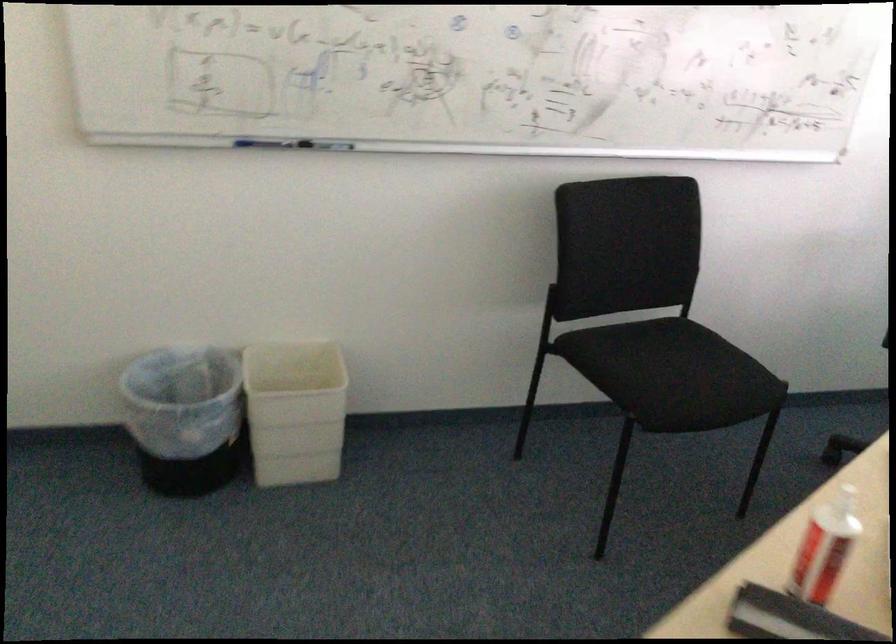
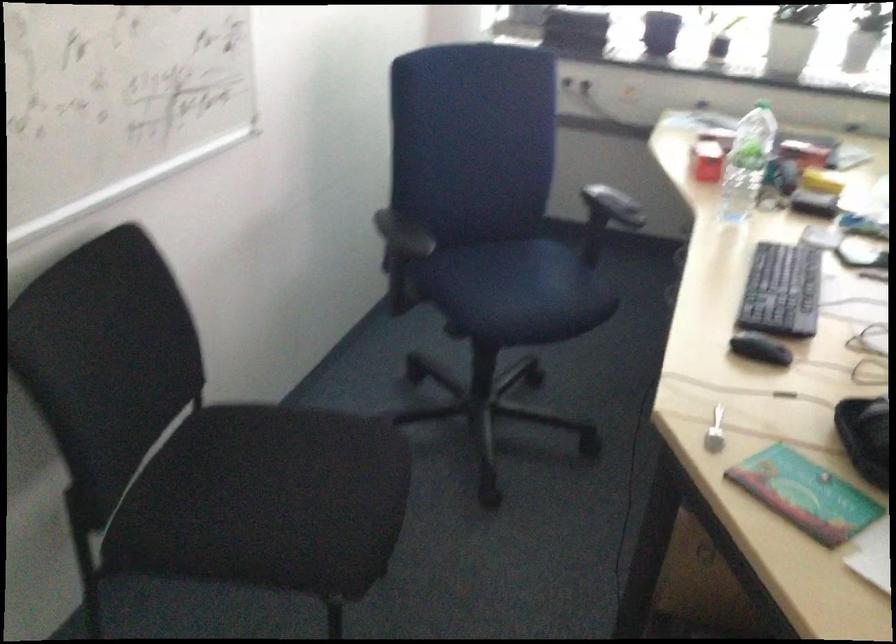
Looking at this image, first-person continuous shooting, in which direction is the camera rotating?

The rotation direction of the camera is right-down.